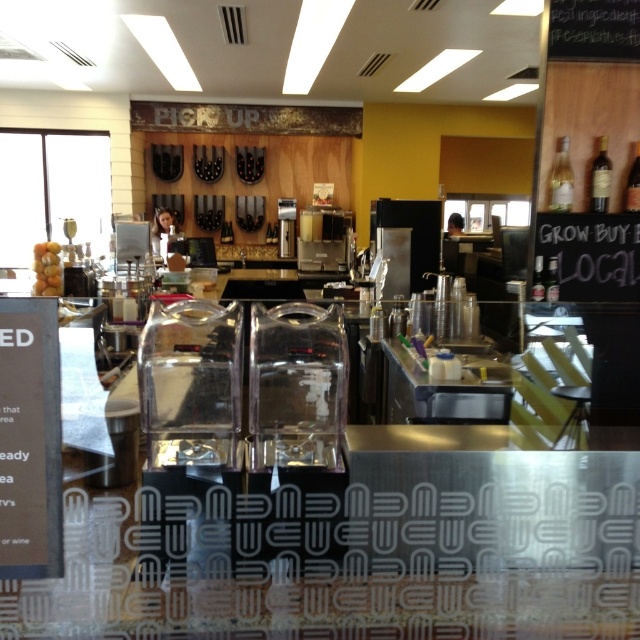
You are a customer at the cafe and want to view the menu. Where should you look to find the black paper menu at lower left?

The black paper menu at lower left is located at point [29,440].

You are a customer at the counter and want to read the black paper menu at lower left and the yellow matte grapes at left. Which object is closer to you?

The black paper menu at lower left is closer to the viewer than the yellow matte grapes at left.